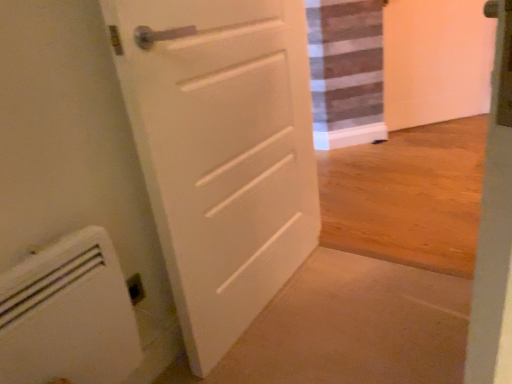
Question: Considering the relative positions of white plastic radiator at lower left and white matte door at center in the image provided, is white plastic radiator at lower left to the left or to the right of white matte door at center?

Choices:
 (A) left
 (B) right

Answer: (A)

Question: Choose the correct answer: Is white plastic radiator at lower left inside white matte door at center or outside it?

Choices:
 (A) outside
 (B) inside

Answer: (A)

Question: Considering their positions, is white plastic radiator at lower left located in front of or behind white matte door at center?

Choices:
 (A) behind
 (B) front

Answer: (B)

Question: In terms of size, does white matte door at center appear bigger or smaller than white plastic radiator at lower left?

Choices:
 (A) small
 (B) big

Answer: (B)

Question: From a real-world perspective, relative to white plastic radiator at lower left, is white matte door at center vertically above or below?

Choices:
 (A) above
 (B) below

Answer: (A)

Question: Considering the positions of white matte door at center and white plastic radiator at lower left in the image, is white matte door at center taller or shorter than white plastic radiator at lower left?

Choices:
 (A) short
 (B) tall

Answer: (B)

Question: Would you say white matte door at center is to the left or to the right of white plastic radiator at lower left in the picture?

Choices:
 (A) left
 (B) right

Answer: (B)